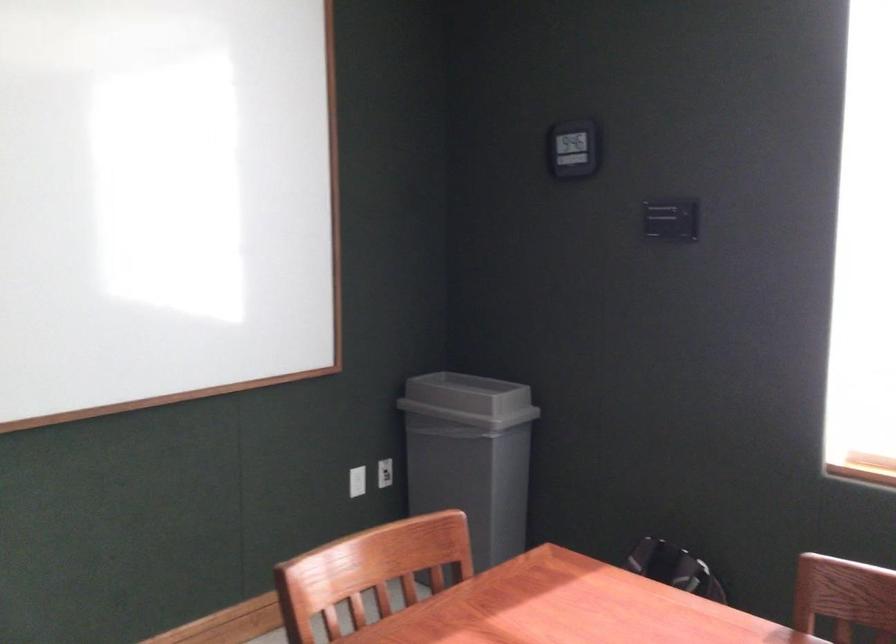
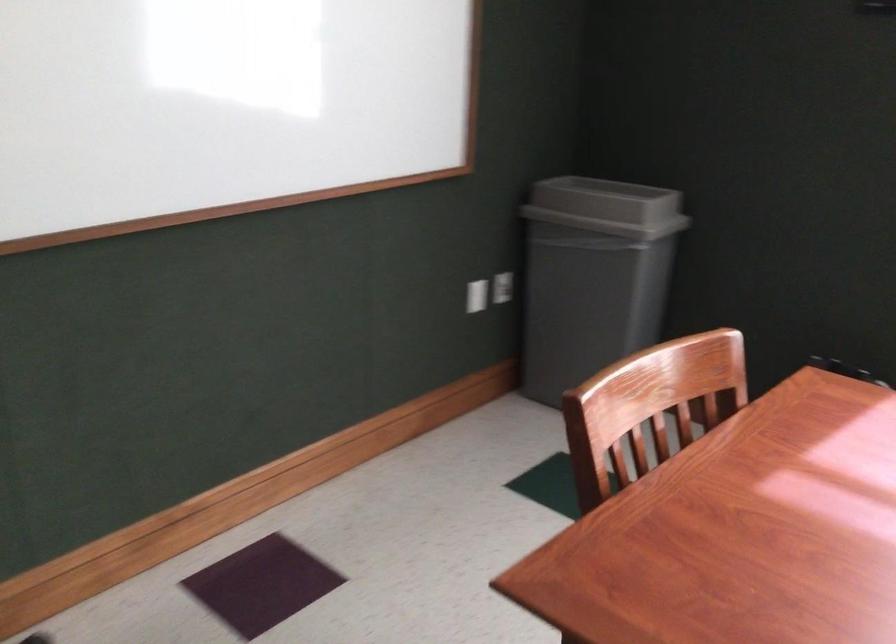
The point at (468, 402) is marked in the first image. Where is the corresponding point in the second image?

(607, 207)